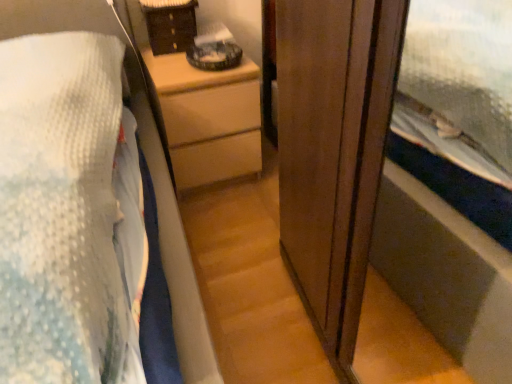
Question: Can you confirm if brown woven basket at upper center is taller than wooden chest of drawers at center?

Choices:
 (A) yes
 (B) no

Answer: (B)

Question: Can we say brown woven basket at upper center lies outside wooden chest of drawers at center?

Choices:
 (A) no
 (B) yes

Answer: (B)

Question: From a real-world perspective, is brown woven basket at upper center on wooden chest of drawers at center?

Choices:
 (A) no
 (B) yes

Answer: (B)

Question: Is brown woven basket at upper center oriented towards wooden chest of drawers at center?

Choices:
 (A) yes
 (B) no

Answer: (B)

Question: Are brown woven basket at upper center and wooden chest of drawers at center beside each other?

Choices:
 (A) no
 (B) yes

Answer: (A)

Question: From the image's perspective, is brown woven basket at upper center on top of wooden chest of drawers at center?

Choices:
 (A) yes
 (B) no

Answer: (A)

Question: Considering the relative positions of wooden chest of drawers at center and brown woven basket at upper center in the image provided, is wooden chest of drawers at center behind brown woven basket at upper center?

Choices:
 (A) no
 (B) yes

Answer: (A)

Question: From the image's perspective, is wooden chest of drawers at center above brown woven basket at upper center?

Choices:
 (A) no
 (B) yes

Answer: (A)

Question: Would you say wooden chest of drawers at center contains brown woven basket at upper center?

Choices:
 (A) no
 (B) yes

Answer: (A)

Question: Does wooden chest of drawers at center have a lesser height compared to brown woven basket at upper center?

Choices:
 (A) no
 (B) yes

Answer: (A)

Question: Are wooden chest of drawers at center and brown woven basket at upper center making contact?

Choices:
 (A) no
 (B) yes

Answer: (A)

Question: Considering the relative sizes of wooden chest of drawers at center and brown woven basket at upper center in the image provided, is wooden chest of drawers at center thinner than brown woven basket at upper center?

Choices:
 (A) yes
 (B) no

Answer: (B)

Question: Relative to wooden chest of drawers at center, is brown woven basket at upper center in front or behind?

Choices:
 (A) behind
 (B) front

Answer: (A)